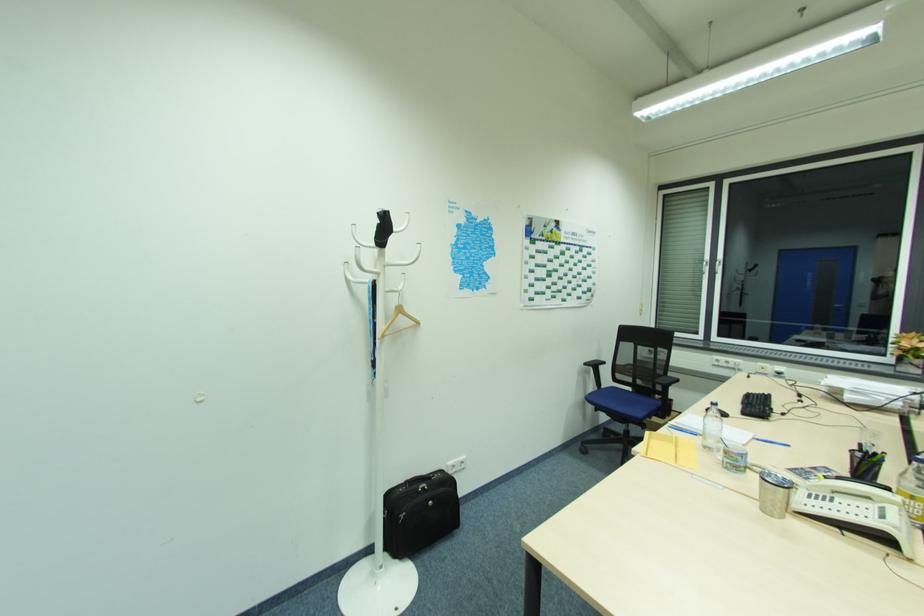
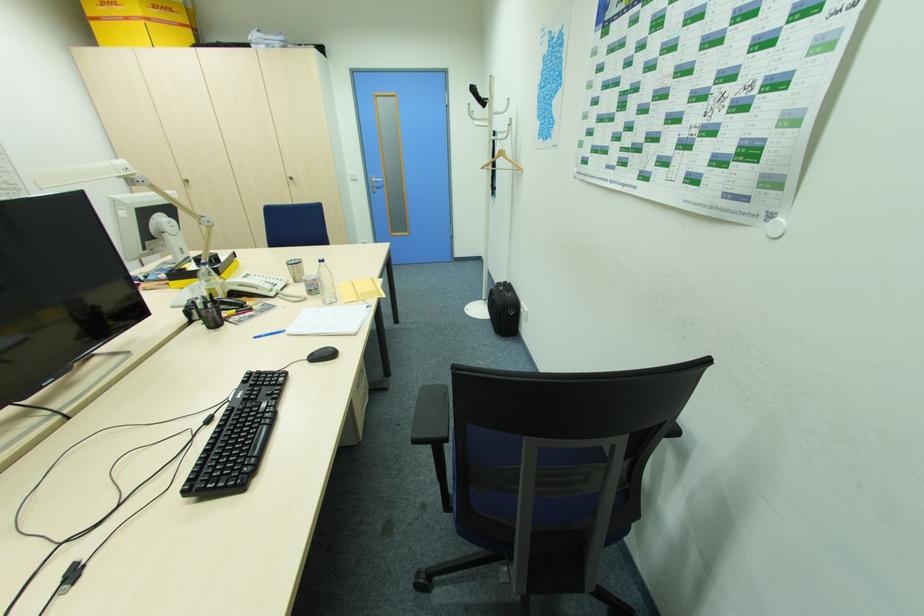
Find the pixel in the second image that matches the point at 791,446 in the first image.

(258, 338)